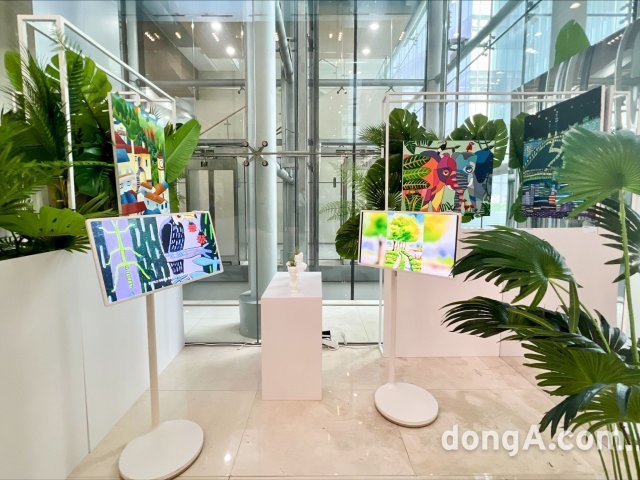
Identify the location of marble floor. (349, 439).